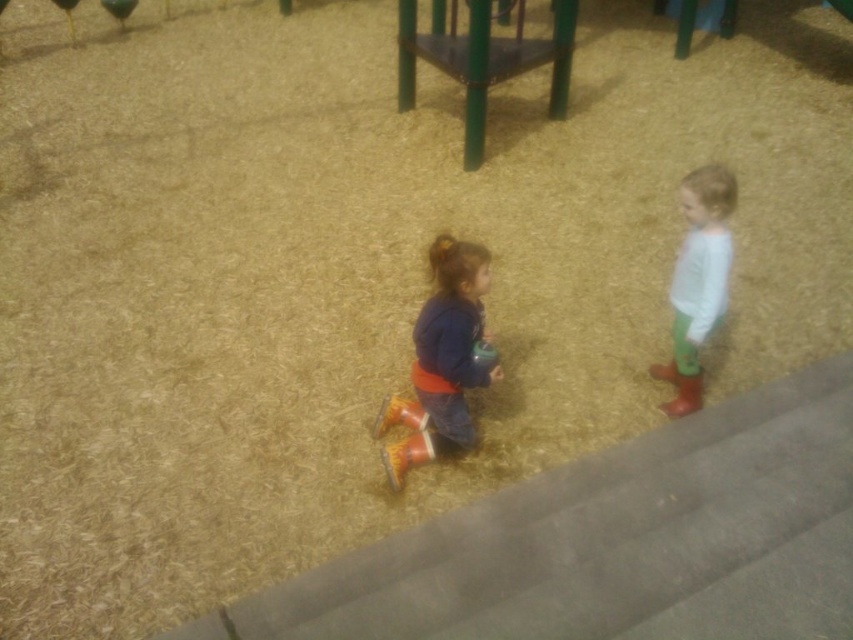
Question: Which object is closer to the camera taking this photo?

Choices:
 (A) white matte shirt at right
 (B) matte orange boots at center

Answer: (B)

Question: Considering the relative positions of matte orange boots at center and white matte shirt at right in the image provided, where is matte orange boots at center located with respect to white matte shirt at right?

Choices:
 (A) below
 (B) above

Answer: (A)

Question: Observing the image, what is the correct spatial positioning of matte orange boots at center in reference to white matte shirt at right?

Choices:
 (A) above
 (B) below

Answer: (B)

Question: Which object appears closest to the camera in this image?

Choices:
 (A) matte orange boots at center
 (B) white matte shirt at right

Answer: (A)

Question: Observing the image, what is the correct spatial positioning of matte orange boots at center in reference to white matte shirt at right?

Choices:
 (A) above
 (B) below

Answer: (B)

Question: Which object is farther from the camera taking this photo?

Choices:
 (A) white matte shirt at right
 (B) matte orange boots at center

Answer: (A)